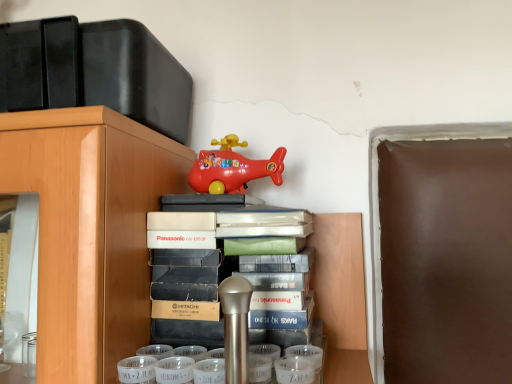
What is the approximate height of white matte book at center?

white matte book at center is 7.49 inches in height.

This screenshot has height=384, width=512. Describe the element at coordinates (229, 268) in the screenshot. I see `white matte book at center` at that location.

What is the approximate width of white matte book at center?

white matte book at center is 8.85 inches in width.

Locate an element on the screen. white matte book at center is located at coordinates [229, 268].

What do you see at coordinates (232, 168) in the screenshot? Image resolution: width=512 pixels, height=384 pixels. I see `matte plastic toy airplane at upper center` at bounding box center [232, 168].

Identify the location of matte plastic toy airplane at upper center. (232, 168).

Locate an element on the screen. white matte book at center is located at coordinates (229, 268).

Based on their positions, is matte plastic toy airplane at upper center located to the left or right of white matte book at center?

matte plastic toy airplane at upper center is positioned on white matte book at center's left side.

Between matte plastic toy airplane at upper center and white matte book at center, which one is positioned in front?

white matte book at center is more forward.

Considering the points (228, 167) and (223, 239), which point is behind, point (228, 167) or point (223, 239)?

The point (228, 167) is behind.

From the image's perspective, which one is positioned higher, matte plastic toy airplane at upper center or white matte book at center?

matte plastic toy airplane at upper center is shown above in the image.

From the picture: From a real-world perspective, does matte plastic toy airplane at upper center stand above white matte book at center?

Indeed, from a real-world perspective, matte plastic toy airplane at upper center stands above white matte book at center.

Looking at their sizes, would you say matte plastic toy airplane at upper center is wider or thinner than white matte book at center?

Clearly, matte plastic toy airplane at upper center has less width compared to white matte book at center.

Who is shorter, matte plastic toy airplane at upper center or white matte book at center?

matte plastic toy airplane at upper center.

Which of these two, matte plastic toy airplane at upper center or white matte book at center, is bigger?

white matte book at center is bigger.

Is matte plastic toy airplane at upper center outside of white matte book at center?

Indeed, matte plastic toy airplane at upper center is completely outside white matte book at center.

Is there a large distance between matte plastic toy airplane at upper center and white matte book at center?

Actually, matte plastic toy airplane at upper center and white matte book at center are a little close together.

Looking at this image, does matte plastic toy airplane at upper center turn towards white matte book at center?

No, matte plastic toy airplane at upper center is not facing towards white matte book at center.

Measure the distance from matte plastic toy airplane at upper center to white matte book at center.

matte plastic toy airplane at upper center is 5.44 inches away from white matte book at center.

You are a GUI agent. You are given a task and a screenshot of the screen. Output one action in this format:
    pyautogui.click(x=<x>, y=<y>)
    Task: Click on the book lying on the right of matte plastic toy airplane at upper center
    The width and height of the screenshot is (512, 384).
    Given the screenshot: What is the action you would take?
    pyautogui.click(x=229, y=268)

Can you confirm if white matte book at center is positioned to the right of matte plastic toy airplane at upper center?

Yes, white matte book at center is to the right of matte plastic toy airplane at upper center.

Which object is further away from the camera taking this photo, white matte book at center or matte plastic toy airplane at upper center?

matte plastic toy airplane at upper center.

Is point (262, 242) positioned before point (203, 168)?

Yes, point (262, 242) is closer to viewer.

From the image's perspective, is white matte book at center on top of matte plastic toy airplane at upper center?

No, from the image's perspective, white matte book at center is not over matte plastic toy airplane at upper center.

From a real-world perspective, which object stands above the other?

matte plastic toy airplane at upper center is physically above.

Does white matte book at center have a lesser width compared to matte plastic toy airplane at upper center?

In fact, white matte book at center might be wider than matte plastic toy airplane at upper center.

Looking at this image, between white matte book at center and matte plastic toy airplane at upper center, which one has less height?

matte plastic toy airplane at upper center.

Considering the relative sizes of white matte book at center and matte plastic toy airplane at upper center in the image provided, is white matte book at center bigger than matte plastic toy airplane at upper center?

Yes, white matte book at center is bigger than matte plastic toy airplane at upper center.

Is matte plastic toy airplane at upper center a part of white matte book at center?

No, matte plastic toy airplane at upper center is located outside of white matte book at center.

Is white matte book at center next to matte plastic toy airplane at upper center and touching it?

No.

Is white matte book at center oriented away from matte plastic toy airplane at upper center?

white matte book at center is not turned away from matte plastic toy airplane at upper center.

How many degrees apart are the facing directions of white matte book at center and matte plastic toy airplane at upper center?

There is a 5.99-degree angle between the facing directions of white matte book at center and matte plastic toy airplane at upper center.

Find the location of a particular element. The width and height of the screenshot is (512, 384). toy above the white matte book at center (from the image's perspective) is located at coordinates (232, 168).

The image size is (512, 384). Find the location of `toy behind the white matte book at center`. toy behind the white matte book at center is located at coordinates (232, 168).

You are a GUI agent. You are given a task and a screenshot of the screen. Output one action in this format:
    pyautogui.click(x=<x>, y=<y>)
    Task: Click on the book that is on the right side of matte plastic toy airplane at upper center
    The image size is (512, 384).
    Given the screenshot: What is the action you would take?
    pyautogui.click(x=229, y=268)